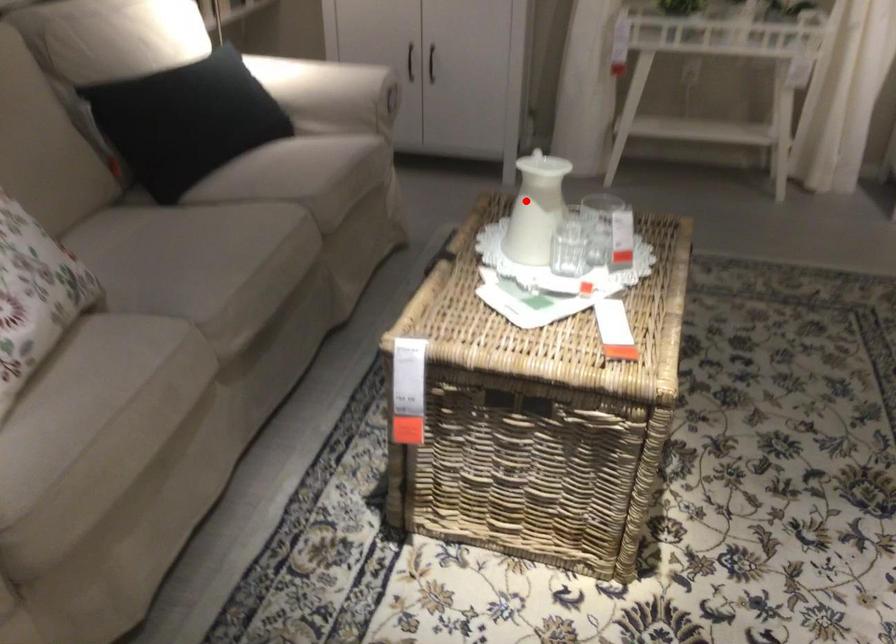
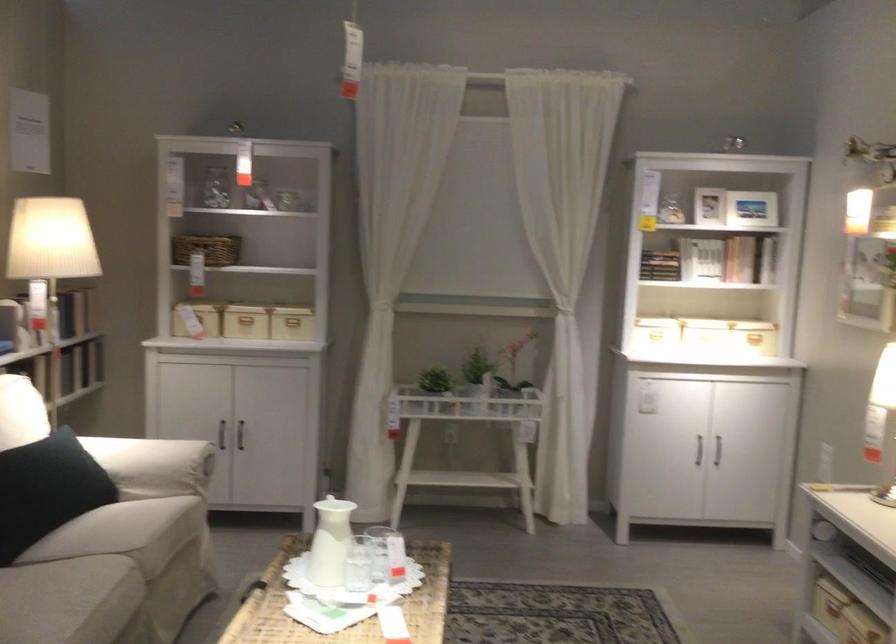
Locate, in the second image, the point that corresponds to the highlighted location in the first image.

(330, 542)